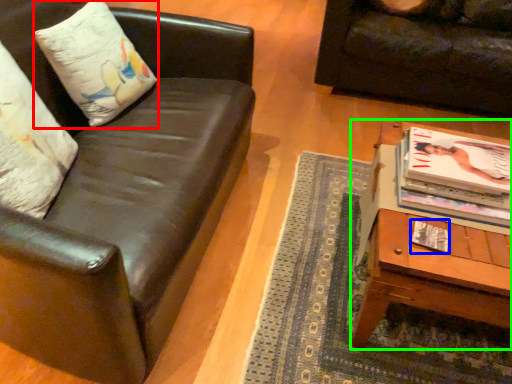
Question: Estimate the real-world distances between objects in this image. Which object is closer to pillow (highlighted by a red box), magazine (highlighted by a blue box) or table (highlighted by a green box)?

Choices:
 (A) magazine
 (B) table

Answer: (B)